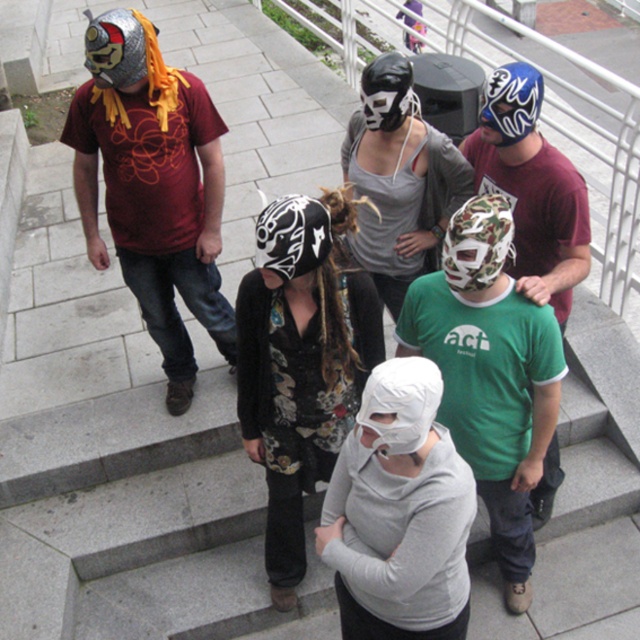
Is matte black mask at center to the left of camo fabric mask at center from the viewer's perspective?

Yes, matte black mask at center is to the left of camo fabric mask at center.

Image resolution: width=640 pixels, height=640 pixels. In order to click on matte black mask at center in this screenshot , I will do `click(400, 179)`.

Between point (378, 81) and point (486, 276), which one is positioned in front?

Point (486, 276) is in front.

Locate an element on the screen. matte black mask at center is located at coordinates (400, 179).

Between black leather jacket at center and camo-patterned mask at center-right, which one is positioned higher?

Positioned higher is camo-patterned mask at center-right.

Can you confirm if black leather jacket at center is wider than camo-patterned mask at center-right?

Indeed, black leather jacket at center has a greater width compared to camo-patterned mask at center-right.

This screenshot has height=640, width=640. I want to click on black leather jacket at center, so click(x=301, y=362).

Where is `camouflage-patterned mask at center`? The image size is (640, 640). camouflage-patterned mask at center is located at coordinates (490, 374).

Who is higher up, camouflage-patterned mask at center or camo-patterned mask at center-right?

camo-patterned mask at center-right

Measure the distance between point (476, 470) and camera.

10.66 feet

Where is `camouflage-patterned mask at center`? Image resolution: width=640 pixels, height=640 pixels. camouflage-patterned mask at center is located at coordinates (490, 374).